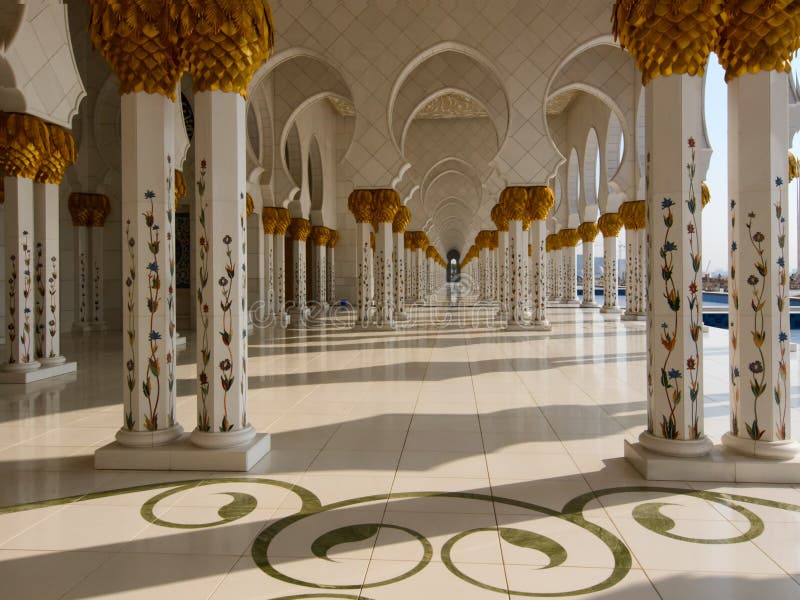
This screenshot has width=800, height=600. In order to click on center of expansive room in this screenshot , I will do `click(453, 335)`.